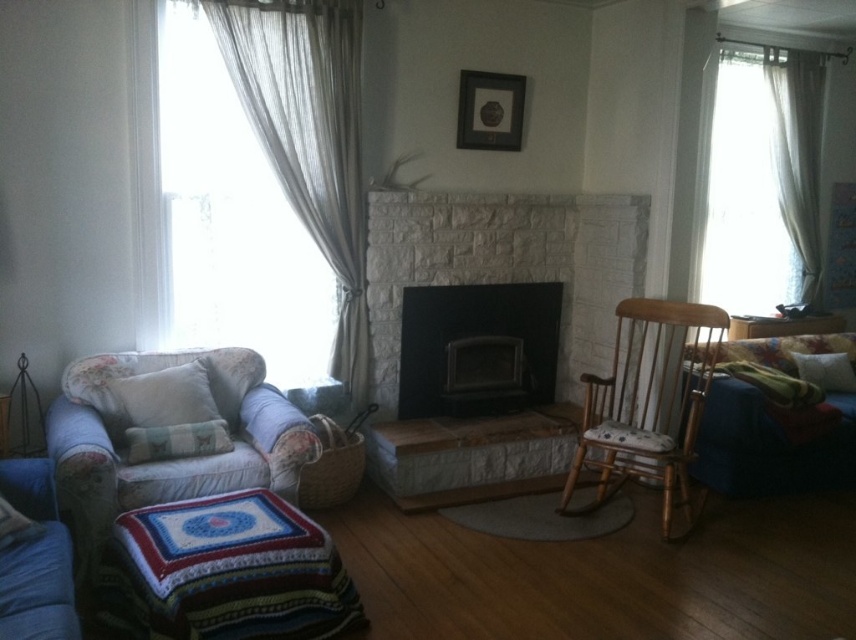
Identify the location of sheer fabric curtain at left. This screenshot has height=640, width=856. (308, 138).

Can you confirm if sheer fabric curtain at left is positioned above black stone fireplace at center?

Indeed, sheer fabric curtain at left is positioned over black stone fireplace at center.

Is point (349, 13) in front of point (428, 291)?

That is True.

You are a GUI agent. You are given a task and a screenshot of the screen. Output one action in this format:
    pyautogui.click(x=<x>, y=<y>)
    Task: Click on the sheer fabric curtain at left
    This screenshot has width=856, height=640.
    Given the screenshot: What is the action you would take?
    pyautogui.click(x=308, y=138)

Which of these two, white sheer curtain at right or white fabric pillow at left, stands shorter?

With less height is white fabric pillow at left.

Can you confirm if white sheer curtain at right is positioned above white fabric pillow at left?

Yes, white sheer curtain at right is above white fabric pillow at left.

Identify the location of white sheer curtain at right. Image resolution: width=856 pixels, height=640 pixels. (797, 154).

Can you confirm if white sheer curtains at upper right is wider than wooden rocking chair at right?

No.

Measure the distance between white sheer curtains at upper right and wooden rocking chair at right.

The distance of white sheer curtains at upper right from wooden rocking chair at right is 1.17 meters.

This screenshot has height=640, width=856. I want to click on white sheer curtains at upper right, so click(758, 180).